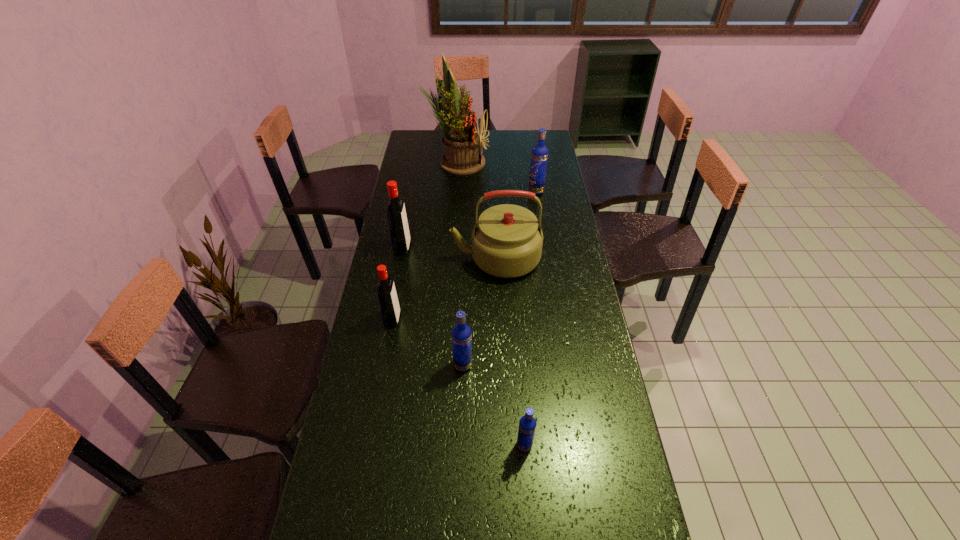
The width and height of the screenshot is (960, 540). Find the location of `vodka that is the fourth closest to the biggest blue vodka`. vodka that is the fourth closest to the biggest blue vodka is located at coordinates coord(527,425).

Select which vodka is the third closest to the kettle. Please provide its 2D coordinates. Your answer should be formatted as a tuple, i.e. [(x, y)], where the tuple contains the x and y coordinates of a point satisfying the conditions above.

[(539, 156)]

Locate an element on the screen. blue vodka that is the closest one to the farthest blue vodka is located at coordinates (461, 333).

Where is `blue vodka that stands as the closest to the rightmost vodka`? blue vodka that stands as the closest to the rightmost vodka is located at coordinates (461, 333).

The image size is (960, 540). What are the coordinates of `the closest red vodka to the farthest blue vodka` in the screenshot? It's located at [x=399, y=232].

What are the coordinates of `red vodka that can be found as the second closest to the green kettle` in the screenshot? It's located at (388, 301).

Where is `free space in the image that satisfies the following two spatial constraints: 1. on the front and back of the fifth farthest object; 2. on the back side of the smallest blue vodka`? This screenshot has height=540, width=960. free space in the image that satisfies the following two spatial constraints: 1. on the front and back of the fifth farthest object; 2. on the back side of the smallest blue vodka is located at coordinates point(370,445).

Image resolution: width=960 pixels, height=540 pixels. I want to click on free spot that satisfies the following two spatial constraints: 1. on the front side of the rightmost vodka; 2. on the front and back of the bigger red vodka, so click(545, 248).

This screenshot has height=540, width=960. In order to click on vacant region that satisfies the following two spatial constraints: 1. on the front and back of the bigger red vodka; 2. on the right side of the second nearest object in this screenshot , I will do `click(380, 365)`.

What are the coordinates of `free spot that satisfies the following two spatial constraints: 1. on the front and back of the bigger red vodka; 2. on the back side of the fourth farthest vodka` in the screenshot? It's located at (380, 365).